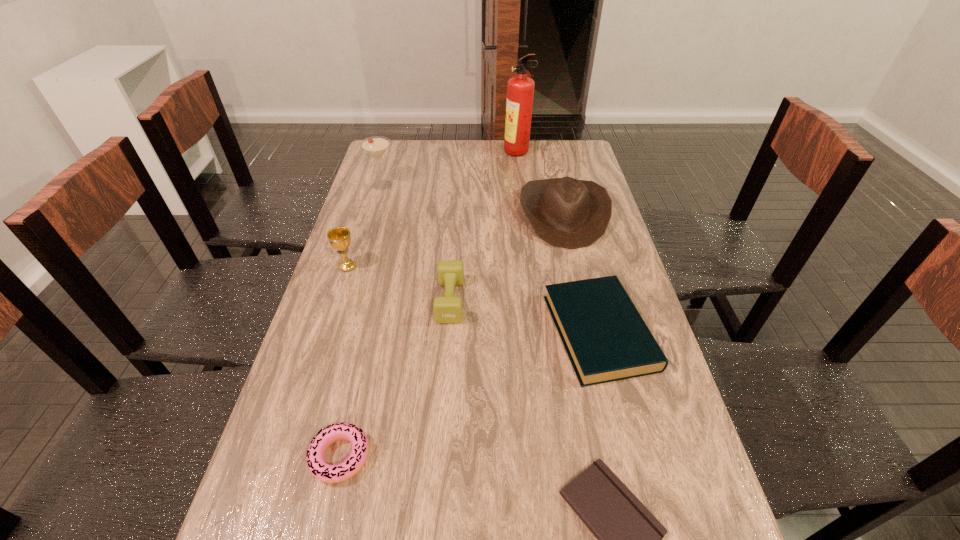
You are a GUI agent. You are given a task and a screenshot of the screen. Output one action in this format:
    pyautogui.click(x=<x>, y=<y>)
    Task: Click on the free space located on the front-facing side of the tallest object
    The height and width of the screenshot is (540, 960).
    Given the screenshot: What is the action you would take?
    pyautogui.click(x=439, y=154)

Find the location of `vacant area located 0.050m on the front-facing side of the tallest object`. vacant area located 0.050m on the front-facing side of the tallest object is located at coordinates (492, 154).

Identify the location of free region located 0.050m on the back of the second tallest object. This screenshot has width=960, height=540. (387, 170).

Identify the location of vacant space located 0.180m on the left of the cowboy hat. The image size is (960, 540). (465, 215).

Locate an element on the screen. This screenshot has width=960, height=540. blank area located 0.380m on the back of the fifth nearest object is located at coordinates (372, 189).

Locate an element on the screen. The height and width of the screenshot is (540, 960). vacant point located on the back of the dumbbell is located at coordinates (454, 239).

Locate an element on the screen. This screenshot has height=540, width=960. free space located 0.290m on the back of the book is located at coordinates (572, 224).

Locate an element on the screen. The image size is (960, 540). free space located on the back of the doughnut is located at coordinates (368, 339).

Locate an element on the screen. This screenshot has height=540, width=960. object positioned at the far edge is located at coordinates (520, 89).

Where is `martini that is at the left edge`? The width and height of the screenshot is (960, 540). martini that is at the left edge is located at coordinates (375, 146).